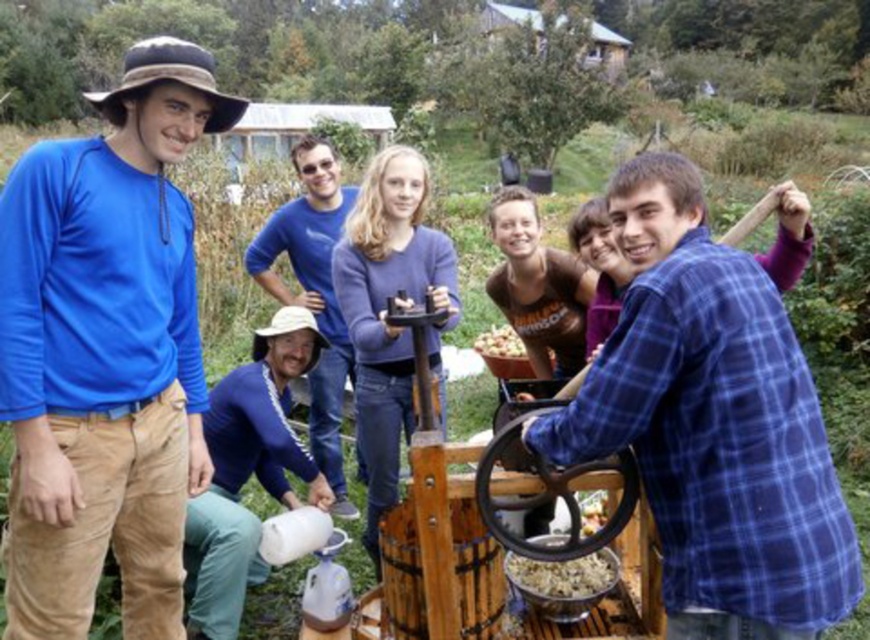
You are standing in front of the cider press and need to reach both the point at coordinates point (797,353) and point (586,582). Which point will require you to reach further away from your current position?

Point (586,582) will require reaching further away from your current position because it is farther from the camera compared to point (797,353).

You are a baker who needs to measure the flour first. You see the smooth brown flour at center and the smooth brown nuts at center. Which one should you move first to access the flour?

The smooth brown flour at center is to the right of the smooth brown nuts at center. To access the flour, you should move the nuts first since they are blocking the flour on the left side.